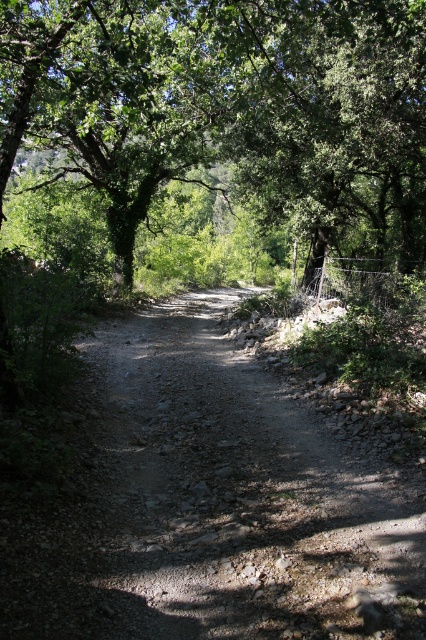
Question: Can you confirm if dusty gravel path at center is smaller than green leafy tree at center?

Choices:
 (A) no
 (B) yes

Answer: (B)

Question: Can you confirm if dusty gravel path at center is positioned below green leafy tree at center?

Choices:
 (A) yes
 (B) no

Answer: (A)

Question: Can you confirm if dusty gravel path at center is positioned to the right of green leafy tree at center?

Choices:
 (A) yes
 (B) no

Answer: (A)

Question: Which of the following is the farthest from the observer?

Choices:
 (A) dusty gravel path at center
 (B) green leafy tree at center

Answer: (B)